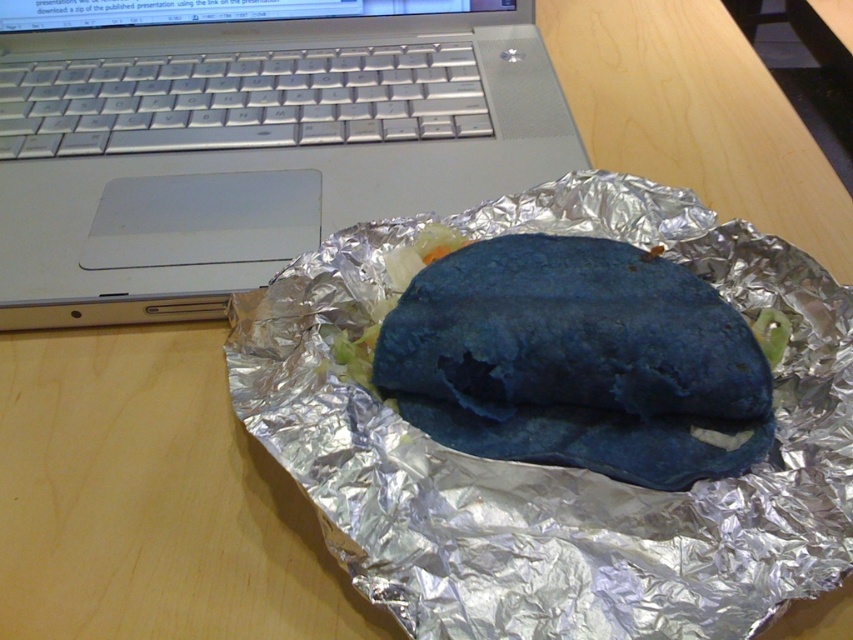
You are a delivery person who needs to place a small package on the desk. The desk has a silver metallic laptop at upper left. Where should you place the package so it doesn not block the laptop?

Place the package away from the silver metallic laptop at upper left, preferably on the opposite side of the desk since the laptop is located at the upper left corner.

You are organizing items on a desk and see the shiny metallic foil at center and the blue matte burrito at center. Which object is positioned to the left side?

The shiny metallic foil at center is to the left of the blue matte burrito at center.

You are organizing items on a desk and need to place both the silver metallic laptop at upper left and the blue matte burrito at center. If you want to ensure the smaller item is placed closer to the edge of the desk, which item should you place there?

The blue matte burrito at center is smaller than the silver metallic laptop at upper left, so you should place the blue matte burrito at center closer to the edge of the desk.